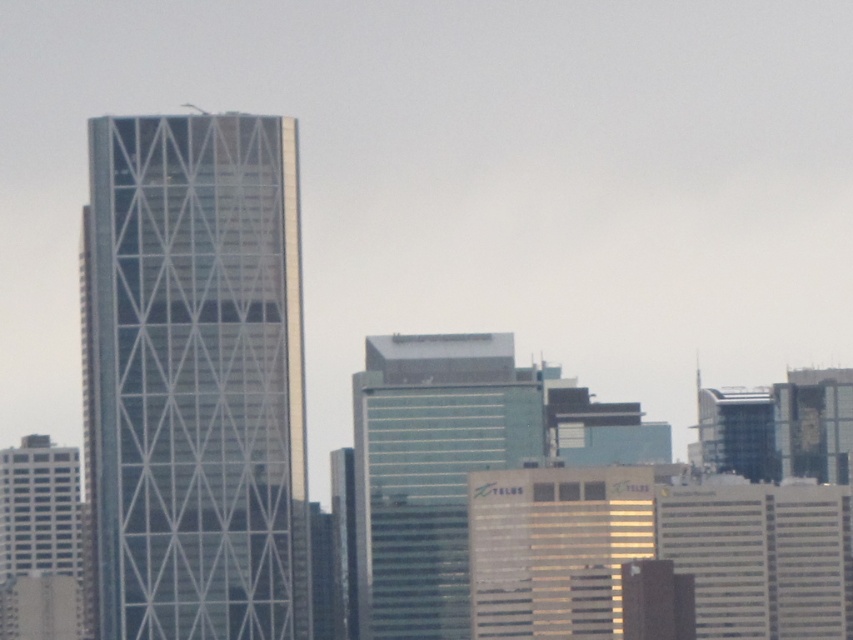
You are a delivery drone with a maximum flight range of 30 meters. You need to deliver a package from the metallic glass tower at left to the green glass building at center. Can you complete the delivery without needing a recharge?

The distance between the metallic glass tower at left and the green glass building at center is 32.40 meters, which exceeds the drone maximum flight range of 30 meters. Therefore, the drone cannot complete the delivery without recharging.

You are standing in the city and see two points in the scene. The first point is labeled as point (283, 522) and the second is point (440, 637). Which point is closer to you?

Point (283, 522) is closer to you because it is in front of point (440, 637).

You are a city planner assessing the skyline for new construction. Given the current layout, which of the two buildings, the metallic glass tower at left or the green glass building at center, would require a crane positioned further back to safely lift materials to its roof?

The metallic glass tower at left has a greater height compared to the green glass building at center, so the crane would need to be positioned further back to safely lift materials to its roof.